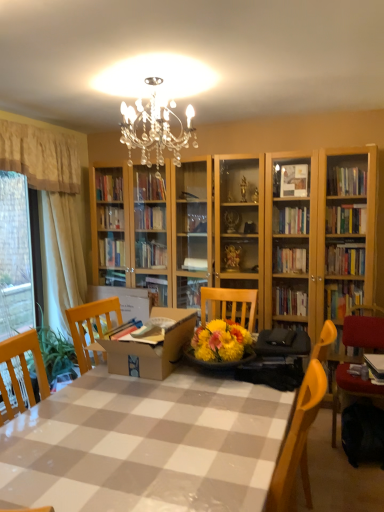
Question: Is cardboard box at center surrounding beige fabric curtain at left, the 3th curtain when ordered from left to right?

Choices:
 (A) no
 (B) yes

Answer: (A)

Question: Is cardboard box at center wider than beige fabric curtain at left, placed as the first curtain when sorted from right to left?

Choices:
 (A) yes
 (B) no

Answer: (A)

Question: From the image's perspective, is cardboard box at center over beige fabric curtain at left, the 3th curtain when ordered from left to right?

Choices:
 (A) yes
 (B) no

Answer: (B)

Question: Is cardboard box at center turned away from beige fabric curtain at left, the 3th curtain when ordered from left to right?

Choices:
 (A) yes
 (B) no

Answer: (B)

Question: Is cardboard box at center in front of beige fabric curtain at left, the 3th curtain when ordered from left to right?

Choices:
 (A) no
 (B) yes

Answer: (B)

Question: From a real-world perspective, is cardboard box at center beneath beige fabric curtain at left, placed as the first curtain when sorted from right to left?

Choices:
 (A) no
 (B) yes

Answer: (B)

Question: Would you say white sheer curtain at left, which is the third curtain from right to left, is a long distance from beige fabric curtain at left, marked as the 2th curtain in a left-to-right arrangement?

Choices:
 (A) yes
 (B) no

Answer: (B)

Question: From a real-world perspective, is white sheer curtain at left, which is the third curtain from right to left, positioned over beige fabric curtain at left, marked as the 2th curtain in a left-to-right arrangement, based on gravity?

Choices:
 (A) yes
 (B) no

Answer: (B)

Question: Would you say white sheer curtain at left, which is the third curtain from right to left, is outside beige fabric curtain at left, marked as the 2th curtain in a left-to-right arrangement?

Choices:
 (A) no
 (B) yes

Answer: (B)

Question: Is beige fabric curtain at left, marked as the 2th curtain in a left-to-right arrangement, located within white sheer curtain at left, acting as the first curtain starting from the left?

Choices:
 (A) no
 (B) yes

Answer: (A)

Question: Considering the relative sizes of white sheer curtain at left, acting as the first curtain starting from the left, and beige fabric curtain at left, marked as the 2th curtain in a left-to-right arrangement, in the image provided, is white sheer curtain at left, acting as the first curtain starting from the left, wider than beige fabric curtain at left, marked as the 2th curtain in a left-to-right arrangement,?

Choices:
 (A) yes
 (B) no

Answer: (B)

Question: Is white sheer curtain at left, which is the third curtain from right to left, shorter than beige fabric curtain at left, marked as the 2th curtain in a left-to-right arrangement?

Choices:
 (A) no
 (B) yes

Answer: (A)

Question: Does checkered plastic table at center come in front of cardboard box at center?

Choices:
 (A) yes
 (B) no

Answer: (A)